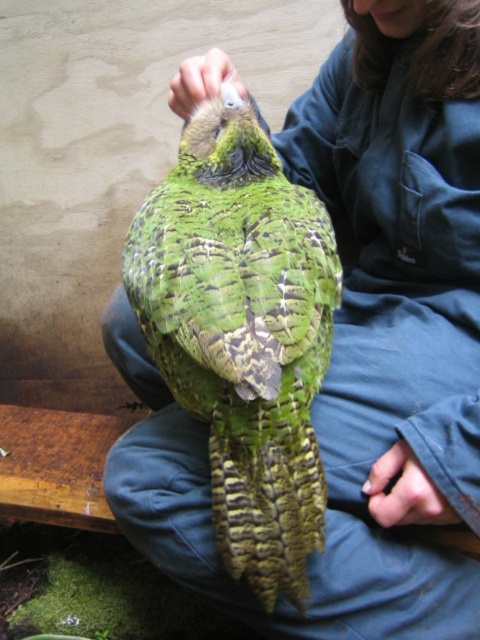
You are a wildlife photographer aiming to capture the kaka bird in the image. Given that the green scaly parrot at center is larger than the white matte hand at upper center, which object should you focus on to ensure the bird fills most of your photo?

The green scaly parrot at center is larger than the white matte hand at upper center, so focusing on the green scaly parrot at center will ensure it fills most of the photo.

You are a wildlife photographer trying to capture a closeup of the kaka_p_o. You notice two hands in your frame, the smooth skin hand at lower right and the white matte hand at upper center. Which hand is more likely to be the one holding the bird for support?

The smooth skin hand at lower right is more likely to be the one holding the bird for support because it is thinner than the white matte hand at upper center, which might indicate it is positioned closer to the bird.